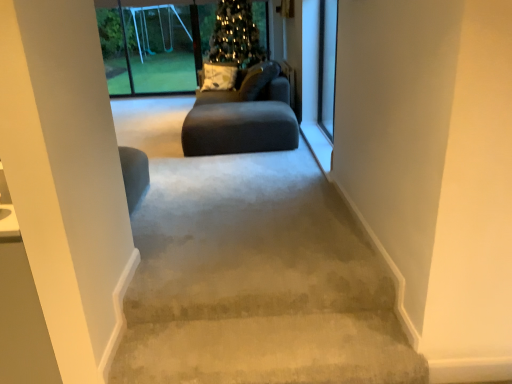
Question: Considering the relative positions of matte gray couch at center and transparent plastic swing set at upper left, the first screen door when ordered from left to right, in the image provided, is matte gray couch at center to the left of transparent plastic swing set at upper left, the first screen door when ordered from left to right, from the viewer's perspective?

Choices:
 (A) yes
 (B) no

Answer: (B)

Question: Is matte gray couch at center closer to camera compared to transparent plastic swing set at upper left, the first screen door when ordered from left to right?

Choices:
 (A) no
 (B) yes

Answer: (B)

Question: Can we say matte gray couch at center lies outside transparent plastic swing set at upper left, the first screen door when ordered from top to bottom?

Choices:
 (A) no
 (B) yes

Answer: (B)

Question: Is the position of matte gray couch at center more distant than that of transparent plastic swing set at upper left, the 2th screen door in the right-to-left sequence?

Choices:
 (A) no
 (B) yes

Answer: (A)

Question: From the image's perspective, is matte gray couch at center on transparent plastic swing set at upper left, the 1th screen door positioned from the back?

Choices:
 (A) yes
 (B) no

Answer: (B)

Question: From the image's perspective, relative to transparent plastic swing set at upper left, the 2th screen door in the right-to-left sequence, is dark gray fabric couch at center above or below?

Choices:
 (A) below
 (B) above

Answer: (A)

Question: Considering their positions, is dark gray fabric couch at center located in front of or behind transparent plastic swing set at upper left, which appears as the 2th screen door when viewed from the front?

Choices:
 (A) behind
 (B) front

Answer: (B)

Question: Based on their positions, is dark gray fabric couch at center located to the left or right of transparent plastic swing set at upper left, the first screen door when ordered from top to bottom?

Choices:
 (A) left
 (B) right

Answer: (B)

Question: Considering the positions of dark gray fabric couch at center and transparent plastic swing set at upper left, the first screen door when ordered from top to bottom, in the image, is dark gray fabric couch at center wider or thinner than transparent plastic swing set at upper left, the first screen door when ordered from top to bottom,?

Choices:
 (A) wide
 (B) thin

Answer: (A)

Question: Would you say clear glass screen door at upper right, which is the 2th screen door from left to right, is to the left or to the right of dark gray fabric couch at center in the picture?

Choices:
 (A) right
 (B) left

Answer: (A)

Question: Looking at their shapes, would you say clear glass screen door at upper right, the 1th screen door from the front, is wider or thinner than dark gray fabric couch at center?

Choices:
 (A) wide
 (B) thin

Answer: (B)

Question: Based on their sizes in the image, would you say clear glass screen door at upper right, the second screen door in the top-to-bottom sequence, is bigger or smaller than dark gray fabric couch at center?

Choices:
 (A) small
 (B) big

Answer: (A)

Question: From their relative heights in the image, would you say clear glass screen door at upper right, the first screen door from the right, is taller or shorter than dark gray fabric couch at center?

Choices:
 (A) tall
 (B) short

Answer: (A)

Question: Would you say transparent plastic swing set at upper left, the 1th screen door positioned from the back, is inside or outside dark gray fabric couch at center?

Choices:
 (A) inside
 (B) outside

Answer: (B)

Question: From their relative heights in the image, would you say transparent plastic swing set at upper left, the first screen door when ordered from top to bottom, is taller or shorter than dark gray fabric couch at center?

Choices:
 (A) tall
 (B) short

Answer: (A)